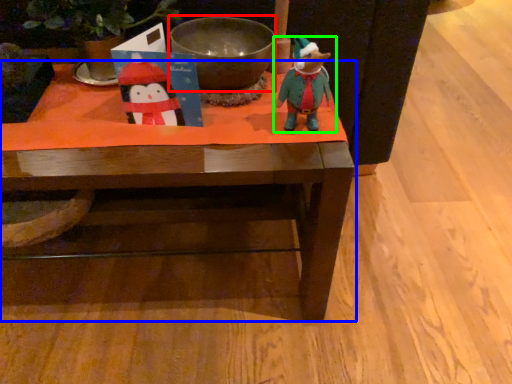
Question: Which is nearer to the bowl (highlighted by a red box)? table (highlighted by a blue box) or toy (highlighted by a green box).

Choices:
 (A) table
 (B) toy

Answer: (B)